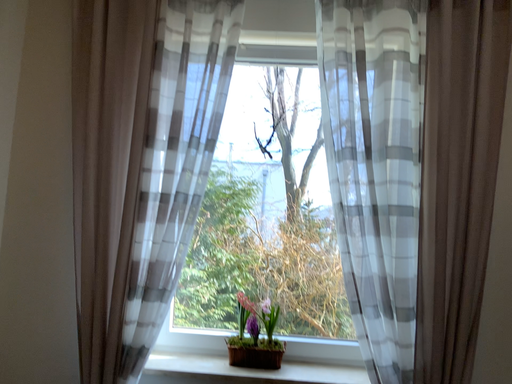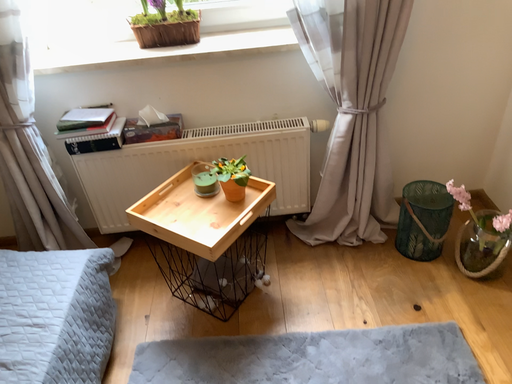
Question: How did the camera likely rotate when shooting the video?

Choices:
 (A) rotated left
 (B) rotated right

Answer: (B)